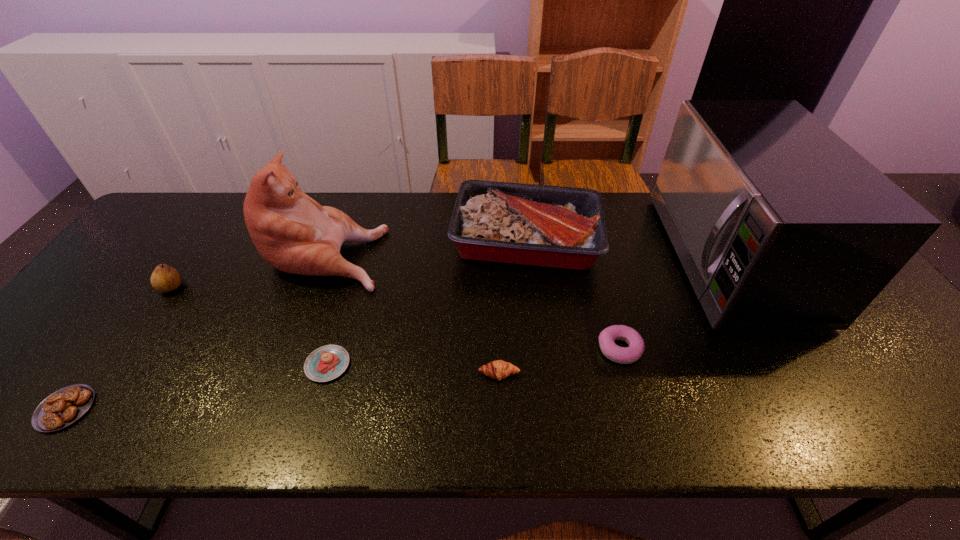
Where is `vacant space located 0.400m with the door open on the microwave oven`? This screenshot has height=540, width=960. vacant space located 0.400m with the door open on the microwave oven is located at coordinates (527, 257).

Identify the location of free space located with the door open on the microwave oven. (613, 257).

Where is `vacant space located on the face of the cat`? vacant space located on the face of the cat is located at coordinates (497, 252).

The width and height of the screenshot is (960, 540). What are the coordinates of `free space located on the front of the third tallest object` in the screenshot? It's located at (543, 387).

Image resolution: width=960 pixels, height=540 pixels. In order to click on vacant point located 0.400m on the right of the fifth shortest object in this screenshot , I will do `click(333, 287)`.

Find the location of a particular element. free space located on the front of the rightmost pastry is located at coordinates (633, 399).

This screenshot has width=960, height=540. Identify the location of vacant space located 0.060m on the left of the second pastry from left to right. (279, 364).

The height and width of the screenshot is (540, 960). I want to click on free space located 0.070m on the left of the nearest pastry, so click(7, 409).

Identify the location of microwave oven that is positioned at the far edge. (779, 224).

Locate an element on the screen. cat that is at the far edge is located at coordinates pos(292,232).